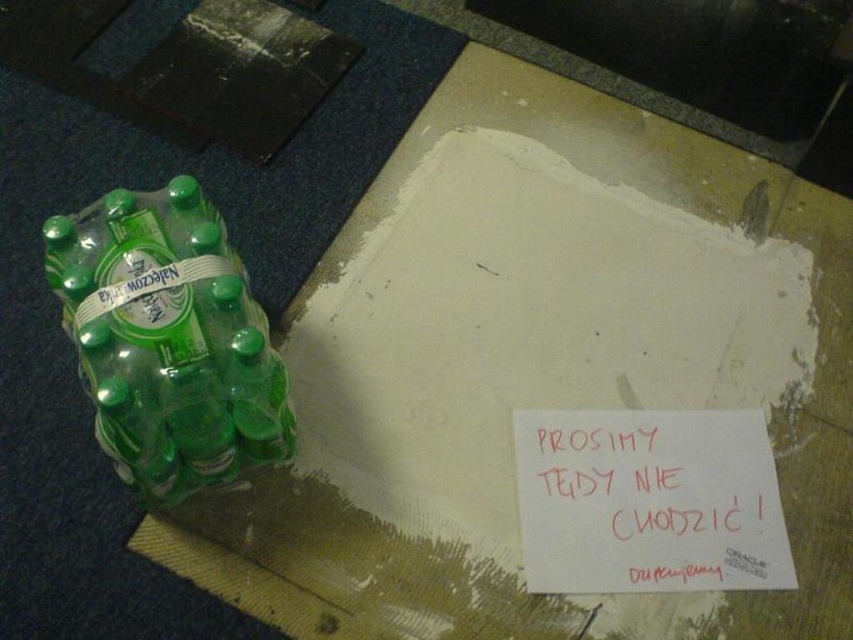
Is red paper sign at center thinner than green plastic bottle at left?

No.

Describe the element at coordinates (648, 500) in the screenshot. The width and height of the screenshot is (853, 640). I see `red paper sign at center` at that location.

Between point (746, 560) and point (241, 406), which one is positioned behind?

The point (746, 560) is more distant.

Locate an element on the screen. red paper sign at center is located at coordinates (648, 500).

Between point (62, 268) and point (519, 522), which one is positioned behind?

Point (519, 522)

Can you confirm if green matte plastic bottles at left is wider than red paper sign at center?

In fact, green matte plastic bottles at left might be narrower than red paper sign at center.

Is point (151, 417) behind point (621, 515)?

No, (151, 417) is closer to viewer.

Locate an element on the screen. green matte plastic bottles at left is located at coordinates click(x=167, y=339).

Is green matte plastic bottles at left smaller than green plastic bottle at left?

Incorrect, green matte plastic bottles at left is not smaller in size than green plastic bottle at left.

Is point (259, 392) more distant than point (258, 356)?

Yes, it is behind point (258, 356).

Find the location of a particular element. Image resolution: width=853 pixels, height=640 pixels. green matte plastic bottles at left is located at coordinates (167, 339).